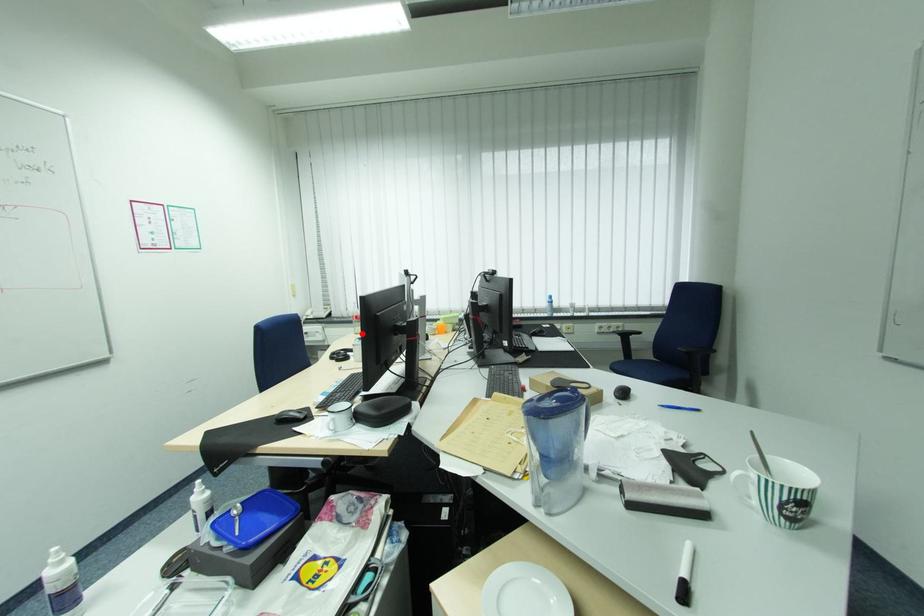
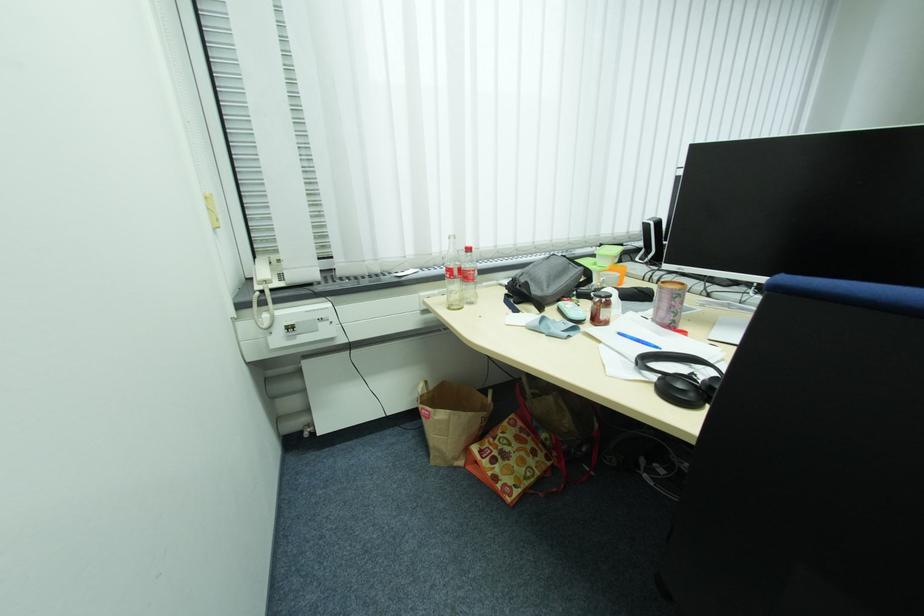
The point at the highlighted location is marked in the first image. Where is the corresponding point in the second image?

(456, 309)